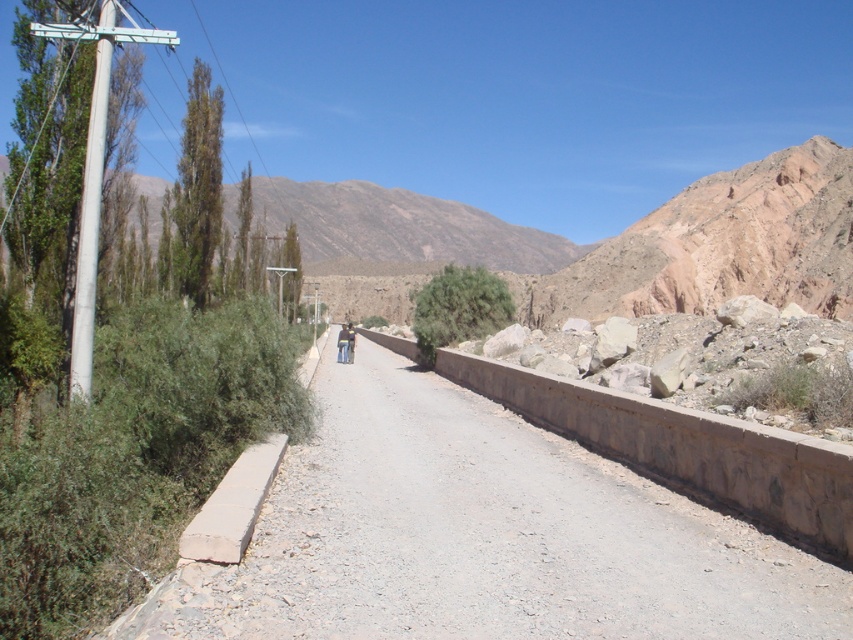
Which is above, dusty gravel road at center or brown leather jacket at center?

brown leather jacket at center is above.

Which is below, dusty gravel road at center or brown leather jacket at center?

Positioned lower is dusty gravel road at center.

In the scene shown: Who is more distant from viewer, (403, 516) or (344, 323)?

Point (344, 323)

At what (x,y) coordinates should I click in order to perform the action: click on dusty gravel road at center. Please return your answer as a coordinate pair (x, y). This screenshot has width=853, height=640. Looking at the image, I should click on (480, 536).

Which is more to the left, white plastic street sign at upper left or dark blue jeans at center?

white plastic street sign at upper left is more to the left.

Is white plastic street sign at upper left positioned behind dark blue jeans at center?

No, it is in front of dark blue jeans at center.

Between point (86, 36) and point (351, 326), which one is positioned in front?

Point (86, 36)

The width and height of the screenshot is (853, 640). What are the coordinates of `white plastic street sign at upper left` in the screenshot? It's located at (103, 33).

Can you confirm if white metallic pole at left is taller than white plastic street sign at upper left?

No, white metallic pole at left is not taller than white plastic street sign at upper left.

Find the location of a particular element. Image resolution: width=853 pixels, height=640 pixels. white metallic pole at left is located at coordinates (91, 211).